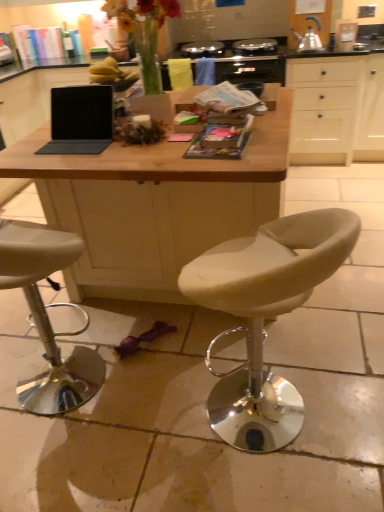
Question: Considering the positions of beige leather stool at lower left, which ranks as the second chair in right-to-left order, and white matte cabinet at upper right in the image, is beige leather stool at lower left, which ranks as the second chair in right-to-left order, bigger or smaller than white matte cabinet at upper right?

Choices:
 (A) small
 (B) big

Answer: (A)

Question: From their relative heights in the image, would you say beige leather stool at lower left, which ranks as the second chair in right-to-left order, is taller or shorter than white matte cabinet at upper right?

Choices:
 (A) tall
 (B) short

Answer: (B)

Question: Estimate the real-world distances between objects in this image. Which object is closer to the matte black laptop at center?

Choices:
 (A) matte paper magazine at center, which is counted as the 1th magazine, starting from the bottom
 (B) white matte cabinet at upper right
 (C) printed paper magazine at center, which is counted as the 1th magazine, starting from the top
 (D) beige leather stool at lower left, the first chair from the left
 (E) wooden desk at center

Answer: (E)

Question: Which object is positioned closest to the printed paper magazine at center, the first magazine from the back?

Choices:
 (A) beige leather stool at lower left, the first chair from the left
 (B) translucent glass vase at upper center
 (C) wooden desk at center
 (D) white leather stool at center, the 1th chair positioned from the right
 (E) matte paper magazine at center, which is counted as the 1th magazine, starting from the bottom

Answer: (E)